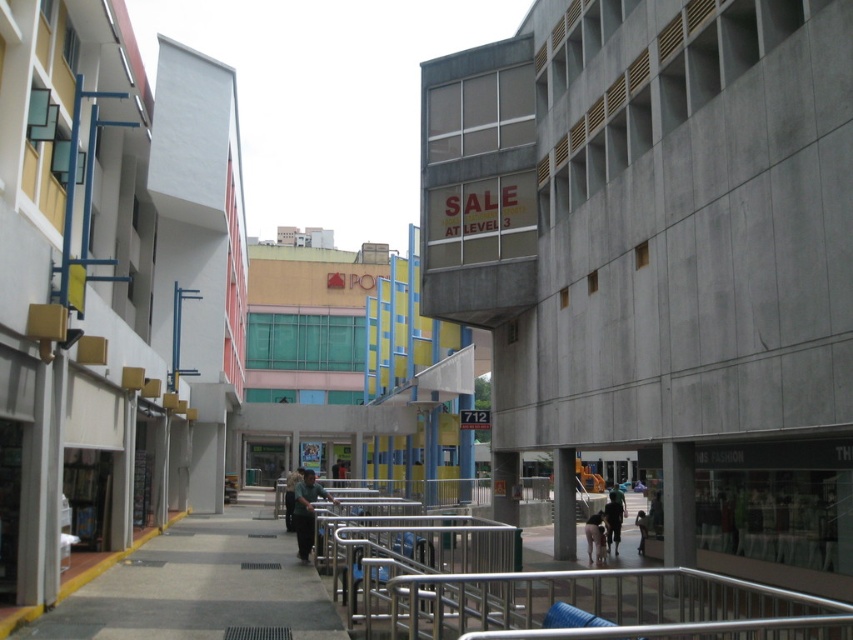
From the picture: Can you confirm if silver metallic railing at center is positioned below dark gray fabric jacket at center?

Incorrect, silver metallic railing at center is not positioned below dark gray fabric jacket at center.

Who is more forward, (350, 577) or (296, 490)?

Point (350, 577) is more forward.

Measure the distance between silver metallic railing at center and camera.

A: silver metallic railing at center is 4.56 meters from camera.

This screenshot has height=640, width=853. Find the location of `silver metallic railing at center`. silver metallic railing at center is located at coordinates (561, 596).

How much distance is there between gray concrete pavement at center and dark gray fabric jacket at center?

gray concrete pavement at center is 3.20 meters from dark gray fabric jacket at center.

Between point (196, 611) and point (299, 490), which one is positioned in front?

Point (196, 611) is in front.

At what (x,y) coordinates should I click in order to perform the action: click on gray concrete pavement at center. Please return your answer as a coordinate pair (x, y). Looking at the image, I should click on (200, 588).

Is gray concrete pavement at center to the right of dark blue fabric jacket at center from the viewer's perspective?

No, gray concrete pavement at center is not to the right of dark blue fabric jacket at center.

Does gray concrete pavement at center come in front of dark blue fabric jacket at center?

Yes.

Between point (238, 552) and point (614, 531), which one is positioned in front?

Point (238, 552) is more forward.

I want to click on gray concrete pavement at center, so click(x=200, y=588).